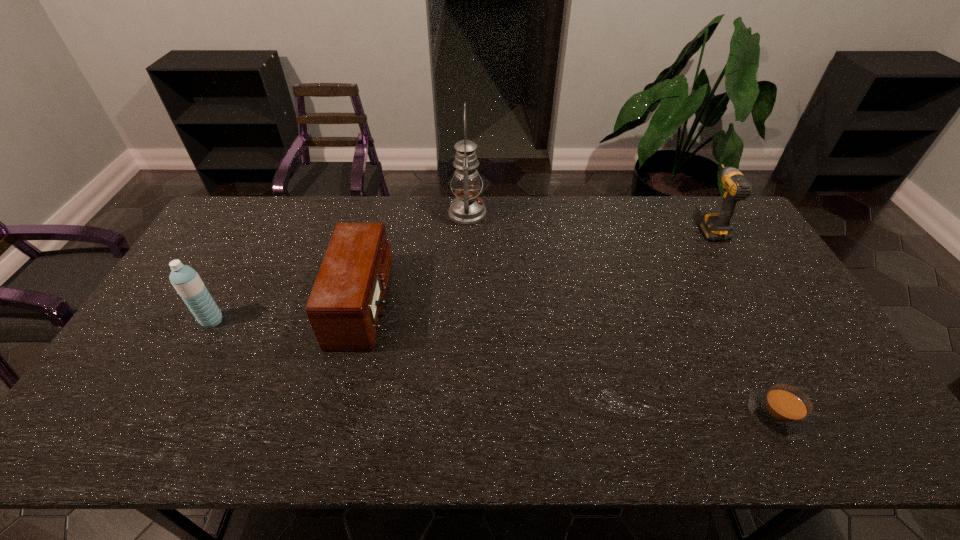
Identify the location of blank area located 0.130m on the right of the leftmost object. (269, 321).

Locate an element on the screen. This screenshot has width=960, height=540. vacant position located 0.280m on the front-facing side of the fourth object from right to left is located at coordinates (486, 305).

Find the location of a particular element. Image resolution: width=960 pixels, height=540 pixels. vacant space situated 0.070m on the back of the shortest object is located at coordinates (752, 366).

Where is `oil lamp that is positioned at the far edge`? oil lamp that is positioned at the far edge is located at coordinates (467, 208).

Image resolution: width=960 pixels, height=540 pixels. Find the location of `drill that is at the far edge`. drill that is at the far edge is located at coordinates (715, 226).

Where is `object present at the near edge`? This screenshot has width=960, height=540. object present at the near edge is located at coordinates (782, 410).

Where is `object located at the left edge`? object located at the left edge is located at coordinates (186, 281).

This screenshot has height=540, width=960. What are the coordinates of `drill situated at the right edge` in the screenshot? It's located at (715, 226).

This screenshot has width=960, height=540. I want to click on cappuccino at the right edge, so click(x=782, y=410).

Find the location of a particular element. object that is at the far right corner is located at coordinates (715, 226).